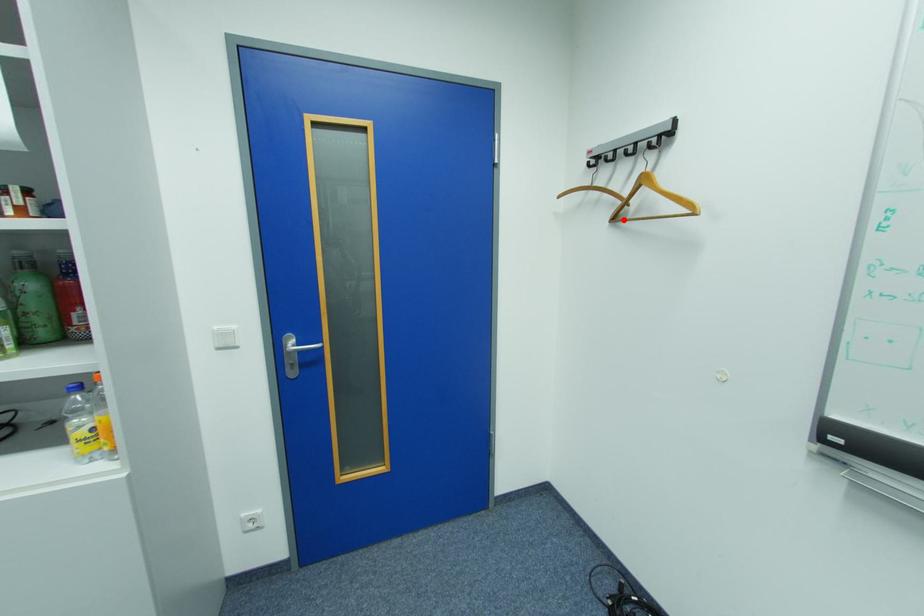
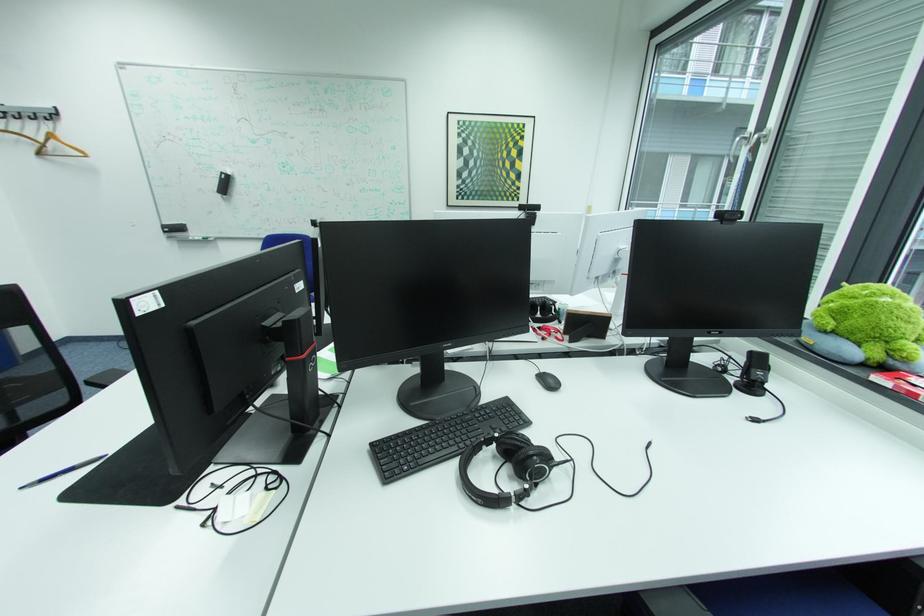
Question: I am providing you with two images of the same scene from different viewpoints. A red point is shown in image1. For the corresponding object point in image2, is it positioned nearer or farther from the camera?

Choices:
 (A) Nearer
 (B) Farther

Answer: (B)